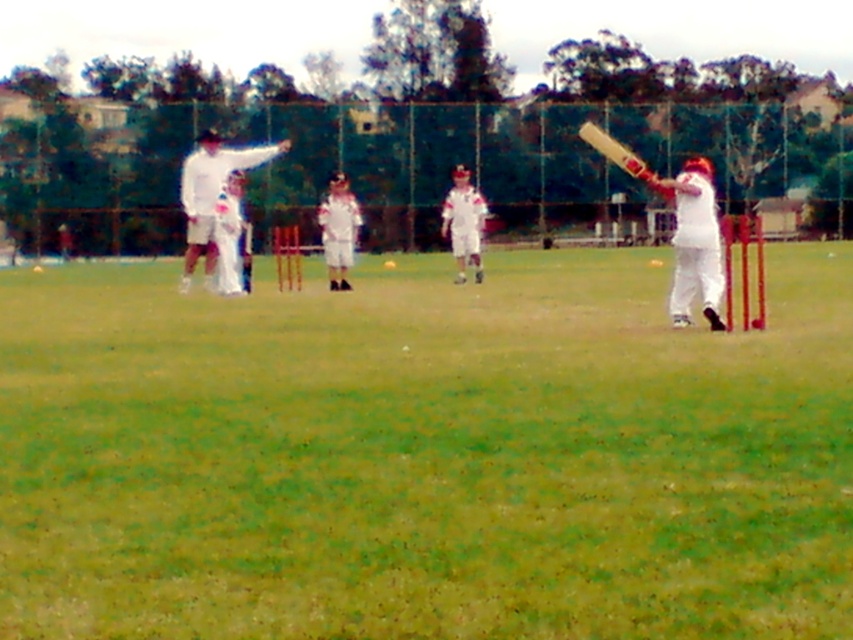
In the scene shown: Between green grass at center and white matte cricket bat at right, which one appears on the right side from the viewer's perspective?

white matte cricket bat at right is more to the right.

Can you confirm if green grass at center is wider than white matte cricket bat at right?

Correct, the width of green grass at center exceeds that of white matte cricket bat at right.

Which is in front, point (202, 579) or point (650, 184)?

Point (202, 579) is in front.

Find the location of a particular element. green grass at center is located at coordinates (425, 454).

Does white clothed figure at left appear under white matte cricket bat at center?

Correct, white clothed figure at left is located below white matte cricket bat at center.

Where is `white clothed figure at left`? white clothed figure at left is located at coordinates (231, 237).

This screenshot has height=640, width=853. I want to click on white clothed figure at left, so click(231, 237).

Identify the location of white matte cricket bat at right. The height and width of the screenshot is (640, 853). (693, 241).

Between point (706, 291) and point (483, 221), which one is positioned in front?

Point (706, 291) is more forward.

Who is more distant from viewer, (712, 228) or (467, 260)?

Point (467, 260)

Where is `white matte cricket bat at right`? white matte cricket bat at right is located at coordinates (693, 241).